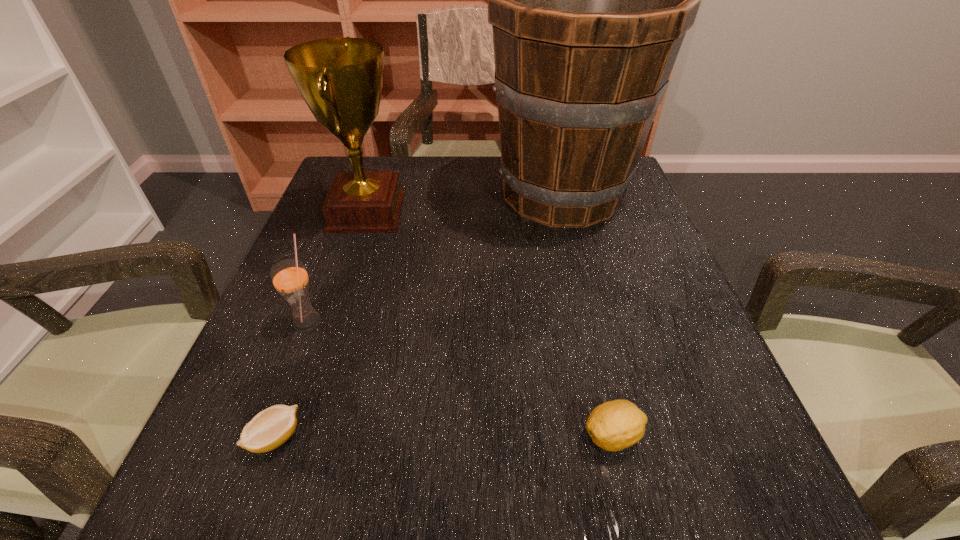
Locate an element on the screen. the tallest object is located at coordinates (590, 0).

You are a GUI agent. You are given a task and a screenshot of the screen. Output one action in this format:
    pyautogui.click(x=<x>, y=<y>)
    Task: Click on the award
    
    Given the screenshot: What is the action you would take?
    pyautogui.click(x=341, y=79)

Where is `the third tallest object`? Image resolution: width=960 pixels, height=540 pixels. the third tallest object is located at coordinates tap(289, 277).

I want to click on straw, so click(x=289, y=277).

I want to click on the right lemon, so click(615, 425).

Locate an element on the screen. the taller lemon is located at coordinates (615, 425).

Identify the location of the shortest object. The height and width of the screenshot is (540, 960). (269, 429).

Identify the location of the shorter lemon. The height and width of the screenshot is (540, 960). (269, 429).

Where is `free region located on the front of the tallest object`? Image resolution: width=960 pixels, height=540 pixels. free region located on the front of the tallest object is located at coordinates (609, 384).

The image size is (960, 540). What are the coordinates of `free space located 0.210m on the plaque of the fourth shortest object` in the screenshot? It's located at (494, 213).